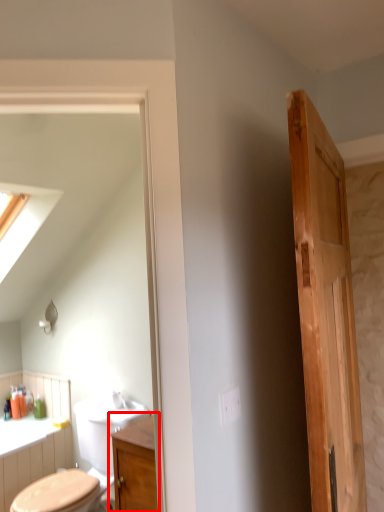
Question: From the image's perspective, considering the relative positions of bathroom cabinet (annotated by the red box) and door in the image provided, where is bathroom cabinet (annotated by the red box) located with respect to the staircase?

Choices:
 (A) above
 (B) below

Answer: (B)